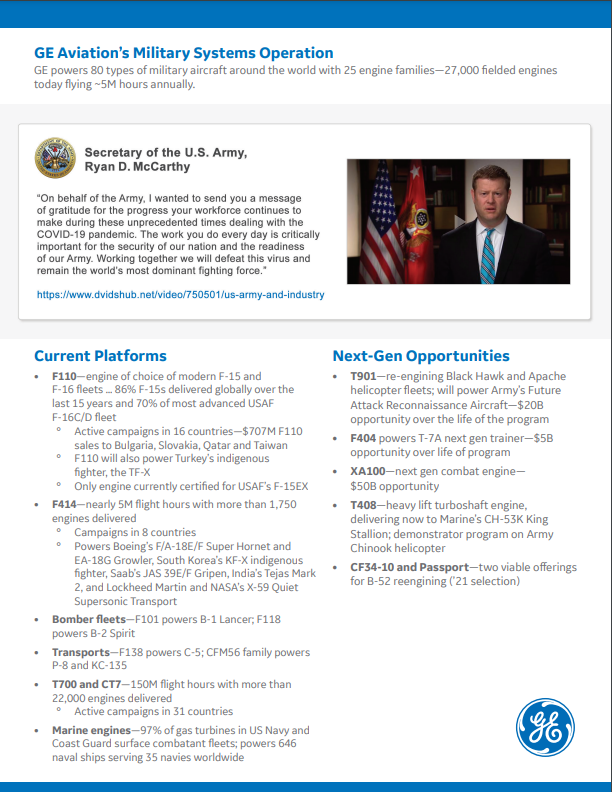
Find the location of `picture`. picture is located at coordinates (501, 202).